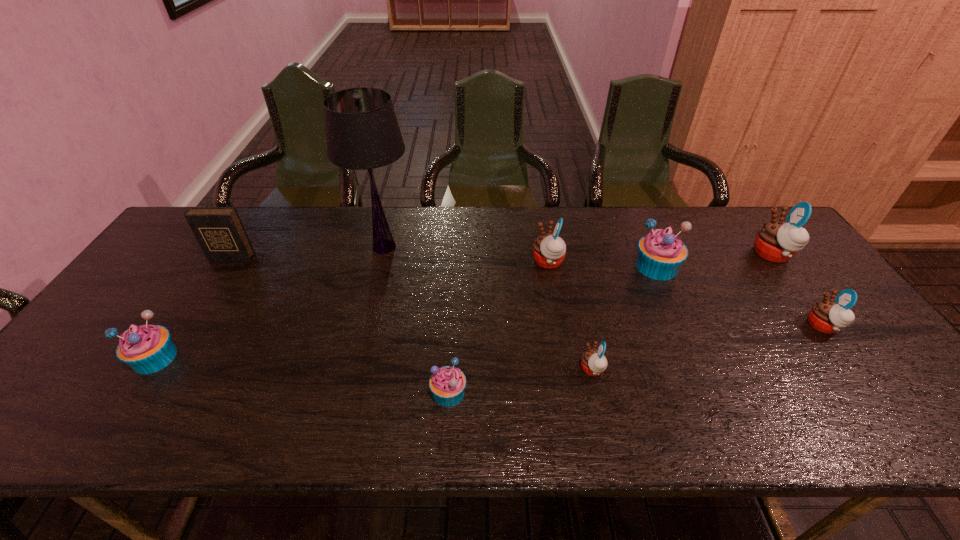
Identify which object is located as the fifth nearest to the fifth muffin from left to right. Please provide its 2D coordinates. Your answer should be formatted as a tuple, i.e. [(x, y)], where the tuple contains the x and y coordinates of a point satisfying the conditions above.

[(447, 384)]

Identify which object is located as the third nearest to the nearest pink muffin. Please provide its 2D coordinates. Your answer should be formatted as a tuple, i.e. [(x, y)], where the tuple contains the x and y coordinates of a point satisfying the conditions above.

[(660, 253)]

Identify the location of the sixth closest muffin to the second blue muffin from left to right. The height and width of the screenshot is (540, 960). (777, 241).

At what (x,y) coordinates should I click in order to perform the action: click on the fourth closest muffin relative to the lampshade. Please return your answer as a coordinate pair (x, y). Looking at the image, I should click on (593, 362).

Identify which pink muffin is located as the third nearest to the second smallest pink muffin. Please provide its 2D coordinates. Your answer should be formatted as a tuple, i.e. [(x, y)], where the tuple contains the x and y coordinates of a point satisfying the conditions above.

[(549, 250)]

What are the coordinates of `pink muffin that stands as the closest to the fourth nearest object` in the screenshot? It's located at (777, 241).

Identify which blue muffin is the nearest to the sixth object from right to left. Please provide its 2D coordinates. Your answer should be formatted as a tuple, i.e. [(x, y)], where the tuple contains the x and y coordinates of a point satisfying the conditions above.

[(660, 253)]

Identify the location of blue muffin object that ranks as the third closest to the diary. (660, 253).

Find the location of a particular element. free space that satisfies the following two spatial constraints: 1. on the front-facing side of the third smallest pink muffin; 2. on the front side of the leftmost blue muffin is located at coordinates (564, 358).